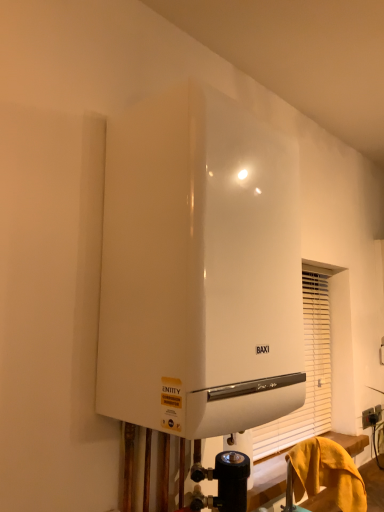
Question: From the image's perspective, is yellow fabric at lower right under black plastic electric outlet at lower right?

Choices:
 (A) no
 (B) yes

Answer: (A)

Question: Can you confirm if yellow fabric at lower right is shorter than black plastic electric outlet at lower right?

Choices:
 (A) no
 (B) yes

Answer: (A)

Question: Is yellow fabric at lower right not inside black plastic electric outlet at lower right?

Choices:
 (A) no
 (B) yes

Answer: (B)

Question: Can you confirm if yellow fabric at lower right is positioned to the left of black plastic electric outlet at lower right?

Choices:
 (A) yes
 (B) no

Answer: (A)

Question: From the image's perspective, is yellow fabric at lower right located above black plastic electric outlet at lower right?

Choices:
 (A) yes
 (B) no

Answer: (A)

Question: Would you consider yellow fabric at lower right to be distant from black plastic electric outlet at lower right?

Choices:
 (A) no
 (B) yes

Answer: (A)

Question: Is the position of yellow fabric at lower right more distant than that of white glossy boiler at upper center?

Choices:
 (A) yes
 (B) no

Answer: (A)

Question: From the image's perspective, is yellow fabric at lower right under white glossy boiler at upper center?

Choices:
 (A) yes
 (B) no

Answer: (A)

Question: Is yellow fabric at lower right taller than white glossy boiler at upper center?

Choices:
 (A) yes
 (B) no

Answer: (B)

Question: Considering the relative positions of yellow fabric at lower right and white glossy boiler at upper center in the image provided, is yellow fabric at lower right to the right of white glossy boiler at upper center from the viewer's perspective?

Choices:
 (A) yes
 (B) no

Answer: (A)

Question: Does yellow fabric at lower right have a smaller size compared to white glossy boiler at upper center?

Choices:
 (A) no
 (B) yes

Answer: (B)

Question: Is yellow fabric at lower right not inside white glossy boiler at upper center?

Choices:
 (A) no
 (B) yes

Answer: (B)

Question: Can you confirm if black plastic electric outlet at lower right is smaller than yellow fabric at lower right?

Choices:
 (A) no
 (B) yes

Answer: (B)